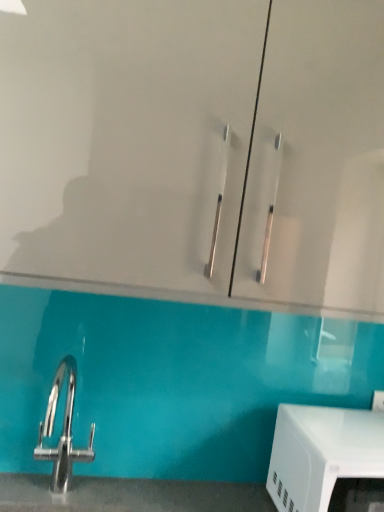
The height and width of the screenshot is (512, 384). What do you see at coordinates (197, 148) in the screenshot?
I see `transparent glass cabinet at upper center` at bounding box center [197, 148].

What are the coordinates of `transparent glass cabinet at upper center` in the screenshot? It's located at (197, 148).

Describe the element at coordinates (323, 452) in the screenshot. I see `white glossy microwave at lower right` at that location.

Locate an element on the screen. The height and width of the screenshot is (512, 384). white glossy microwave at lower right is located at coordinates (323, 452).

In order to face white glossy microwave at lower right, should I rotate leftwards or rightwards?

To face it directly, rotate right by 21.979 degrees.

Where is `transparent glass cabinet at upper center`? This screenshot has width=384, height=512. transparent glass cabinet at upper center is located at coordinates (197, 148).

Which object is positioned more to the right, white glossy microwave at lower right or transparent glass cabinet at upper center?

white glossy microwave at lower right is more to the right.

Which object is closer to the camera taking this photo, white glossy microwave at lower right or transparent glass cabinet at upper center?

transparent glass cabinet at upper center is closer to the camera.

Is point (294, 439) closer or farther from the camera than point (113, 30)?

Clearly, point (294, 439) is more distant from the camera than point (113, 30).

From the image's perspective, which one is positioned higher, white glossy microwave at lower right or transparent glass cabinet at upper center?

transparent glass cabinet at upper center.

From a real-world perspective, is white glossy microwave at lower right physically located above or below transparent glass cabinet at upper center?

white glossy microwave at lower right is situated lower than transparent glass cabinet at upper center in the real world.

Considering the sizes of objects white glossy microwave at lower right and transparent glass cabinet at upper center in the image provided, who is thinner, white glossy microwave at lower right or transparent glass cabinet at upper center?

With smaller width is white glossy microwave at lower right.

Considering the relative sizes of white glossy microwave at lower right and transparent glass cabinet at upper center in the image provided, is white glossy microwave at lower right shorter than transparent glass cabinet at upper center?

Correct, white glossy microwave at lower right is not as tall as transparent glass cabinet at upper center.

Who is smaller, white glossy microwave at lower right or transparent glass cabinet at upper center?

white glossy microwave at lower right is smaller.

Is transparent glass cabinet at upper center surrounded by white glossy microwave at lower right?

Definitely not — transparent glass cabinet at upper center is not inside white glossy microwave at lower right.

Can you see white glossy microwave at lower right touching transparent glass cabinet at upper center?

No, white glossy microwave at lower right is not with transparent glass cabinet at upper center.

Is white glossy microwave at lower right aimed at transparent glass cabinet at upper center?

No, white glossy microwave at lower right does not turn towards transparent glass cabinet at upper center.

How many degrees apart are the facing directions of white glossy microwave at lower right and transparent glass cabinet at upper center?

white glossy microwave at lower right and transparent glass cabinet at upper center are facing 1.86 degrees away from each other.

The width and height of the screenshot is (384, 512). What are the coordinates of `glass door on the left of white glossy microwave at lower right` in the screenshot? It's located at (197, 148).

Considering the positions of objects transparent glass cabinet at upper center and white glossy microwave at lower right in the image provided, who is more to the left, transparent glass cabinet at upper center or white glossy microwave at lower right?

Positioned to the left is transparent glass cabinet at upper center.

Is transparent glass cabinet at upper center in front of or behind white glossy microwave at lower right in the image?

In the image, transparent glass cabinet at upper center appears in front of white glossy microwave at lower right.

Which point is more distant from viewer, (x=330, y=244) or (x=304, y=496)?

The point (x=304, y=496) is more distant.

Consider the image. From the image's perspective, is transparent glass cabinet at upper center positioned above or below white glossy microwave at lower right?

From the image's perspective, transparent glass cabinet at upper center appears above white glossy microwave at lower right.

From a real-world perspective, who is located higher, transparent glass cabinet at upper center or white glossy microwave at lower right?

From a 3D spatial view, transparent glass cabinet at upper center is above.

Which object is thinner, transparent glass cabinet at upper center or white glossy microwave at lower right?

white glossy microwave at lower right is thinner.

Considering the relative sizes of transparent glass cabinet at upper center and white glossy microwave at lower right in the image provided, is transparent glass cabinet at upper center taller than white glossy microwave at lower right?

Correct, transparent glass cabinet at upper center is much taller as white glossy microwave at lower right.

In the scene shown: Considering the sizes of objects transparent glass cabinet at upper center and white glossy microwave at lower right in the image provided, who is bigger, transparent glass cabinet at upper center or white glossy microwave at lower right?

transparent glass cabinet at upper center is bigger.

Is transparent glass cabinet at upper center not within white glossy microwave at lower right?

Yes, transparent glass cabinet at upper center is not within white glossy microwave at lower right.

Is there a large distance between transparent glass cabinet at upper center and white glossy microwave at lower right?

No, there isn't a large distance between transparent glass cabinet at upper center and white glossy microwave at lower right.

Is transparent glass cabinet at upper center facing towards white glossy microwave at lower right?

No, transparent glass cabinet at upper center does not turn towards white glossy microwave at lower right.

In order to click on appliance directly beneath the transparent glass cabinet at upper center (from a real-world perspective) in this screenshot , I will do `click(323, 452)`.

At what (x,y) coordinates should I click in order to perform the action: click on appliance behind the transparent glass cabinet at upper center. Please return your answer as a coordinate pair (x, y). The image size is (384, 512). Looking at the image, I should click on (323, 452).

Where is `appliance directly beneath the transparent glass cabinet at upper center (from a real-world perspective)`? appliance directly beneath the transparent glass cabinet at upper center (from a real-world perspective) is located at coordinates (323, 452).